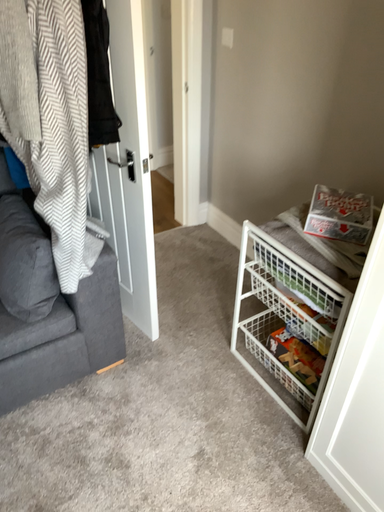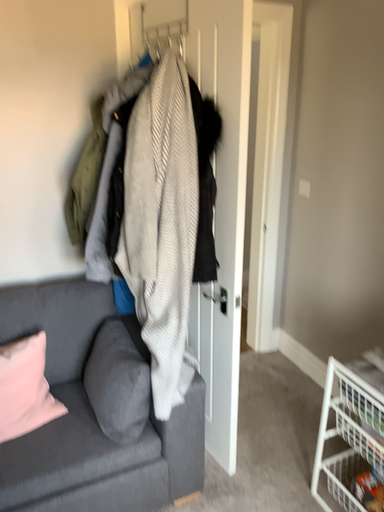
Question: Which way did the camera rotate in the video?

Choices:
 (A) rotated right
 (B) rotated left

Answer: (B)